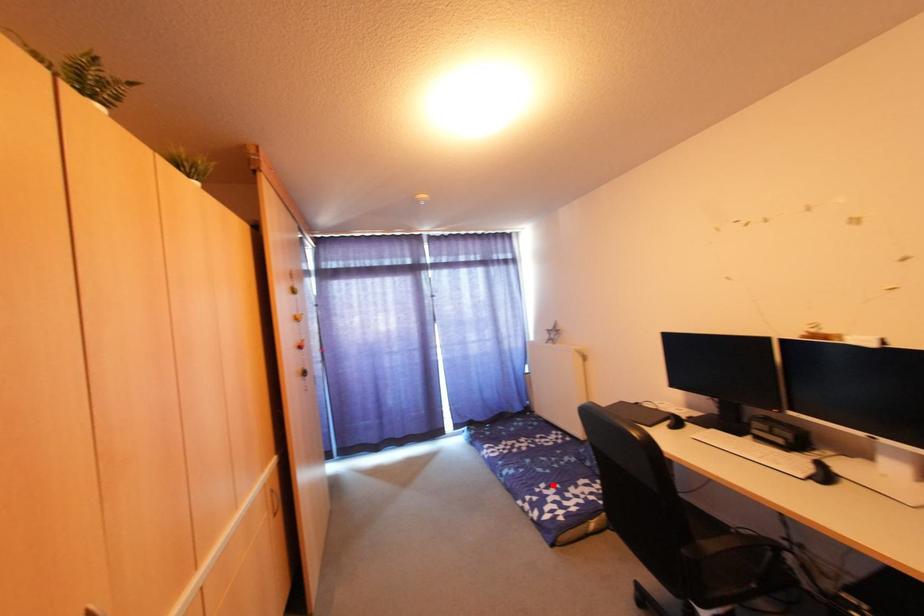
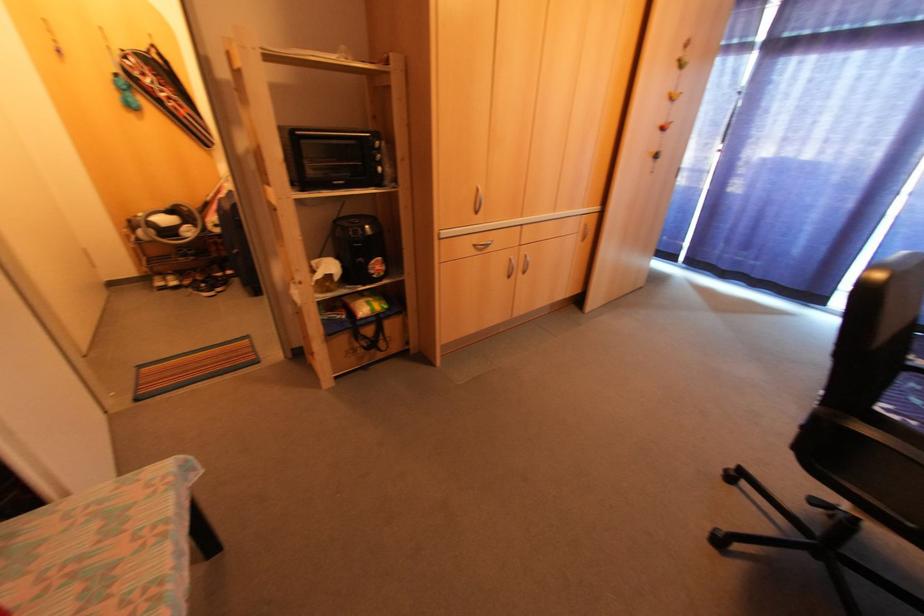
Question: I am providing you with two images of the same scene from different viewpoints. A red point is marked on the first image. Can you still see the location of the red point in image 2?

Choices:
 (A) Yes
 (B) No

Answer: (A)